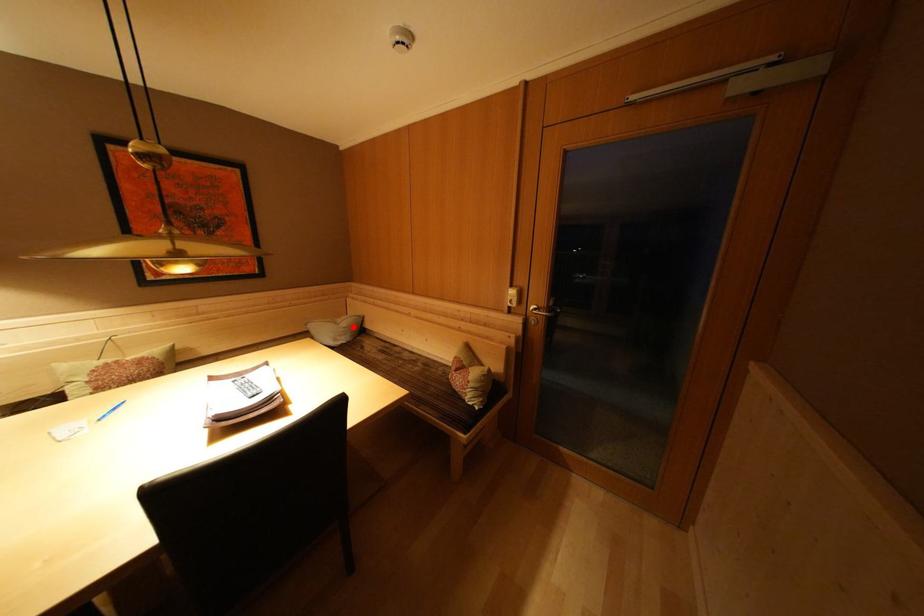
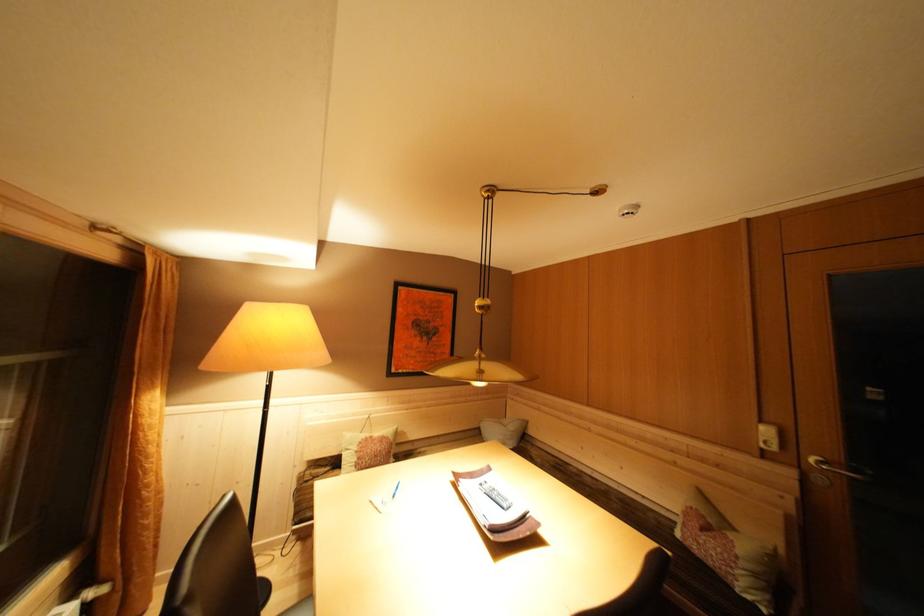
Question: I am providing you with two images of the same scene from different viewpoints. Given a red point in image1, look at the same physical point in image2. Is it:

Choices:
 (A) Closer to the viewpoint
 (B) Farther from the viewpoint

Answer: (B)